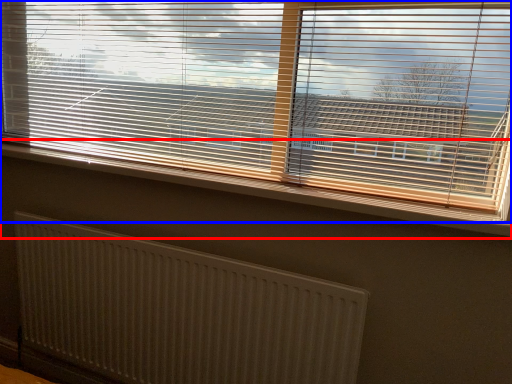
Question: Which point is further to the camera, window sill (highlighted by a red box) or window blind (highlighted by a blue box)?

Choices:
 (A) window sill
 (B) window blind

Answer: (A)